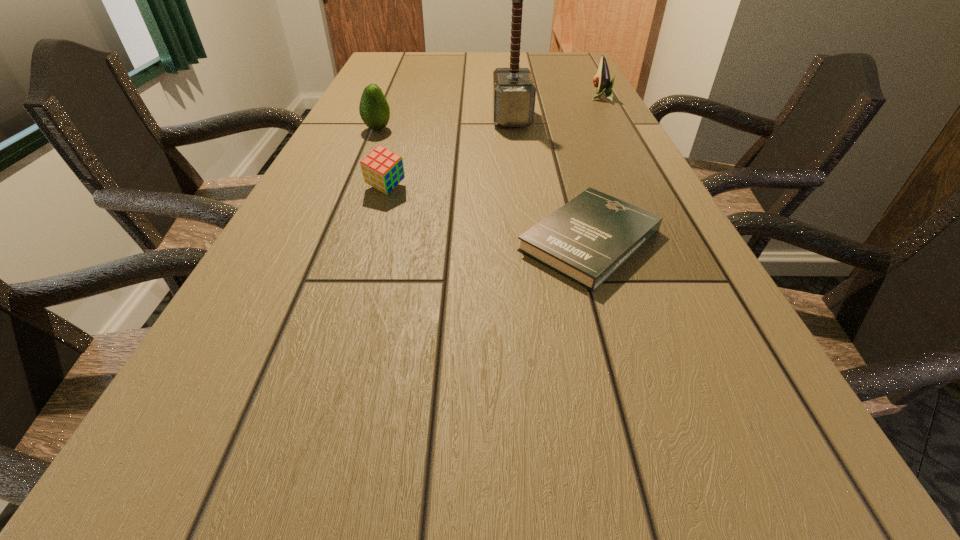
Identify which object is the nearest to the shortest object. Please provide its 2D coordinates. Your answer should be formatted as a tuple, i.e. [(x, y)], where the tuple contains the x and y coordinates of a point satisfying the conditions above.

[(382, 169)]

This screenshot has width=960, height=540. Identify the location of vacant area in the image that satisfies the following two spatial constraints: 1. on the seed side of the farther avocado; 2. on the front side of the tallest object. (612, 118).

Where is `free space that satisfies the following two spatial constraints: 1. on the seed side of the right avocado; 2. on the front side of the left avocado`? This screenshot has height=540, width=960. free space that satisfies the following two spatial constraints: 1. on the seed side of the right avocado; 2. on the front side of the left avocado is located at coordinates click(617, 129).

Find the location of a particular element. The width and height of the screenshot is (960, 540). free location that satisfies the following two spatial constraints: 1. on the front side of the shortest object; 2. on the right side of the nearer avocado is located at coordinates (332, 240).

You are a GUI agent. You are given a task and a screenshot of the screen. Output one action in this format:
    pyautogui.click(x=<x>, y=<y>)
    Task: Click on the vacant area that satisfies the following two spatial constraints: 1. on the back side of the second shortest object; 2. on the right side of the tallest object
    This screenshot has width=960, height=540.
    Given the screenshot: What is the action you would take?
    click(x=407, y=118)

Identify the location of blank area in the image that satisfies the following two spatial constraints: 1. on the seed side of the right avocado; 2. on the front side of the cube. (650, 188).